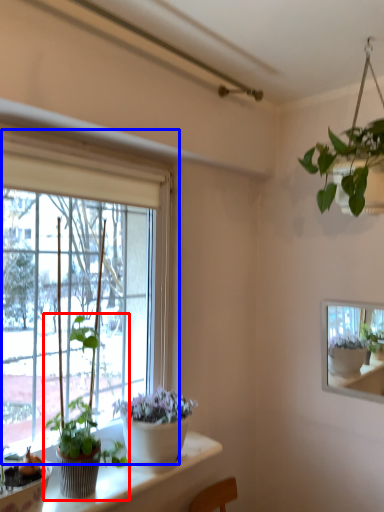
Question: Which point is closer to the camera, houseplant (highlighted by a red box) or window (highlighted by a blue box)?

Choices:
 (A) houseplant
 (B) window

Answer: (B)